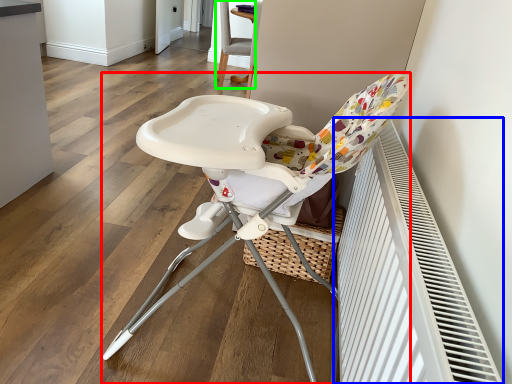
Question: Estimate the real-world distances between objects in this image. Which object is farther from chair (highlighted by a red box), air conditioning (highlighted by a blue box) or chair (highlighted by a green box)?

Choices:
 (A) air conditioning
 (B) chair

Answer: (B)